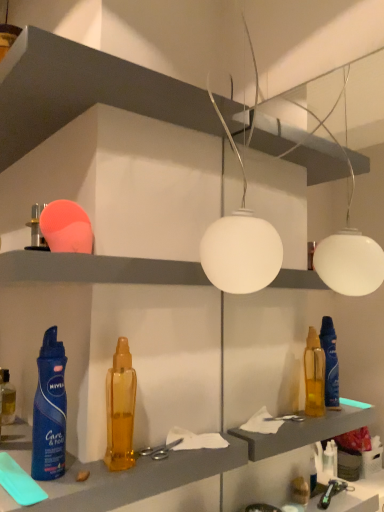
Question: Is point (248, 243) closer or farther from the camera than point (46, 347)?

Choices:
 (A) farther
 (B) closer

Answer: (B)

Question: In terms of height, does white matte globe at center look taller or shorter compared to blue matte spray can at lower left, which is the 1th bottle from front to back?

Choices:
 (A) tall
 (B) short

Answer: (A)

Question: Estimate the real-world distances between objects in this image. Which object is closer to the translucent amber bottle at center, the 2th bottle when ordered from back to front?

Choices:
 (A) matte plastic shelf at upper center, arranged as the first shelf when ordered from the bottom
 (B) white matte shelf at upper center, arranged as the first shelf when viewed from the top
 (C) blue matte spray can at lower left, which is the 1th bottle from front to back
 (D) silver metallic scissors at center
 (E) white matte globe at center

Answer: (D)

Question: Which of these objects is positioned farthest from the silver metallic scissors at center?

Choices:
 (A) translucent amber bottle at lower left, acting as the first bottle starting from the left
 (B) white matte shelf at upper center, arranged as the first shelf when viewed from the top
 (C) translucent plastic bottle at center
 (D) matte plastic shelf at upper center, the 2th shelf positioned from the top
 (E) blue matte spray can at lower left, placed as the 2th bottle when sorted from left to right

Answer: (B)